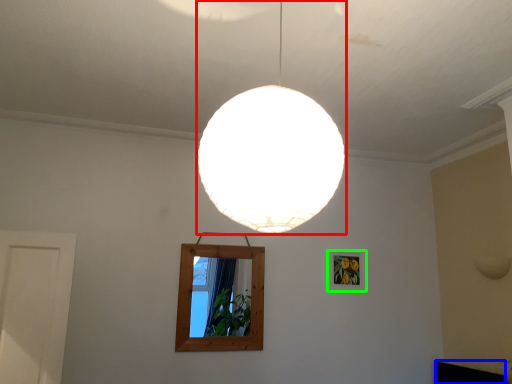
Question: Which is farther away from lamp (highlighted by a red box)? furniture (highlighted by a blue box) or picture frame (highlighted by a green box)?

Choices:
 (A) furniture
 (B) picture frame

Answer: (A)